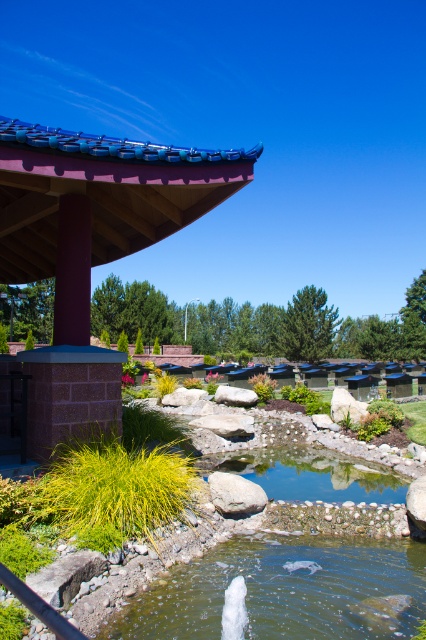
Consider the image. You are standing in the serene outdoor setting described. You see two points marked in the image. Which point is closer to you, point [288,632] or point [241,496]?

Point [288,632] is closer to the viewer than point [241,496].

Consider the image. You are standing in the outdoor scene and want to pour the green liquid water at lower center onto the gray rough rock at center. Is the water already positioned in a way that allows it to naturally flow upwards to reach the rock?

The green liquid water at lower center is located below the gray rough rock at center, so the water cannot naturally flow upwards to reach the rock since water flows downward due to gravity.